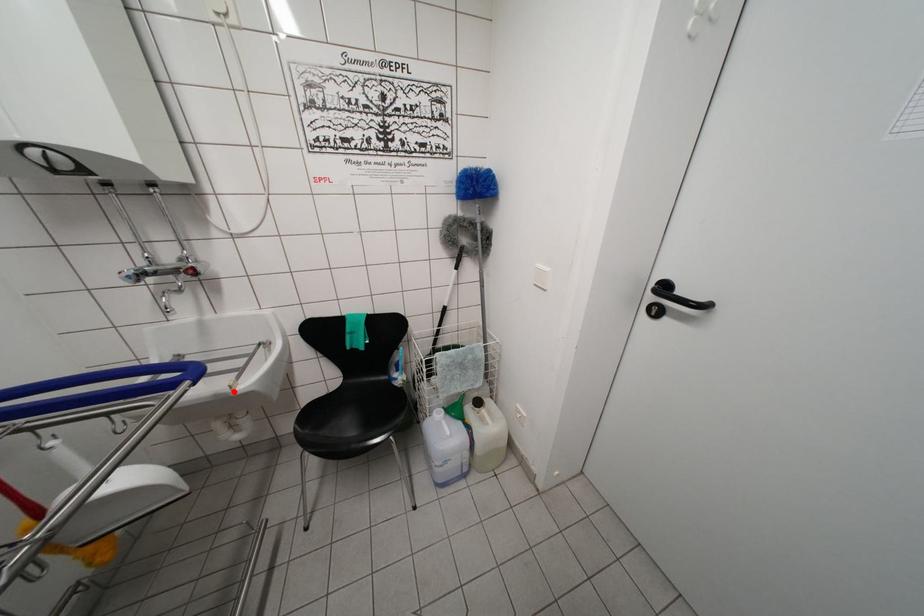
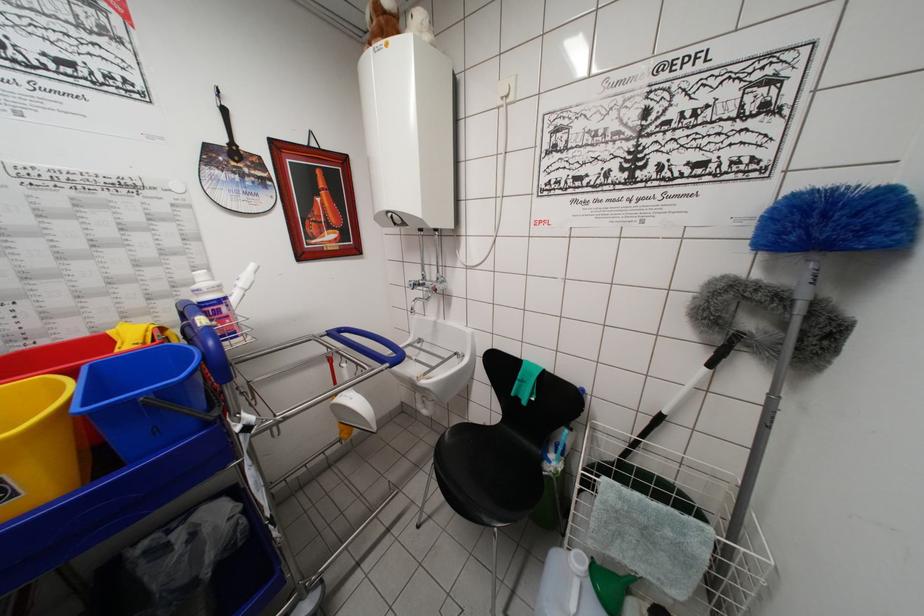
The point at the highlighted location is marked in the first image. Where is the corresponding point in the second image?

(420, 383)